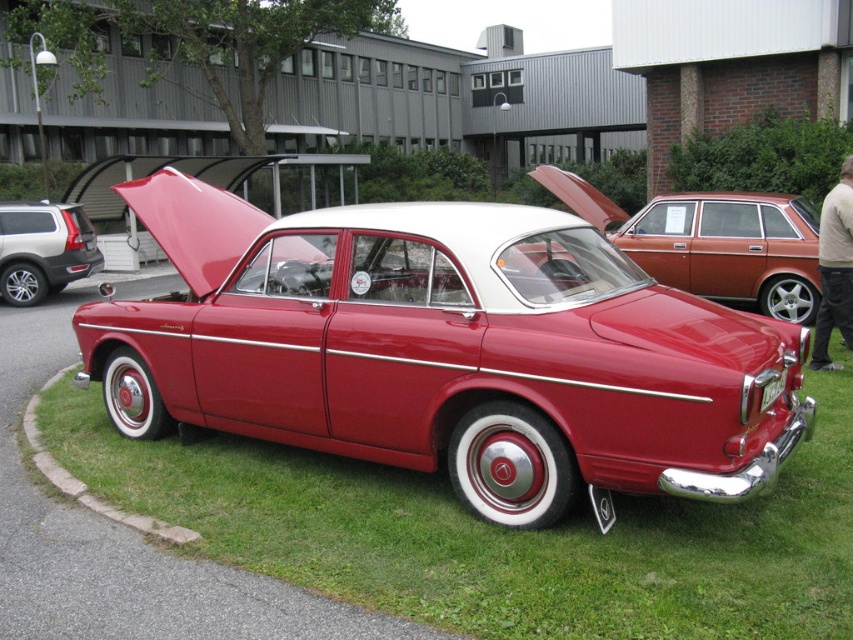
What do you see at coordinates (711, 241) in the screenshot? I see `shiny red car at center` at bounding box center [711, 241].

Is point (700, 285) farther from viewer compared to point (4, 221)?

No.

Which is in front, point (587, 204) or point (4, 250)?

Point (587, 204)

You are a GUI agent. You are given a task and a screenshot of the screen. Output one action in this format:
    pyautogui.click(x=<x>, y=<y>)
    Task: Click on the shiny red car at center
    
    Given the screenshot: What is the action you would take?
    pyautogui.click(x=711, y=241)

Does green grass at lower center appear on the right side of matte silver suv at left?

Yes, green grass at lower center is to the right of matte silver suv at left.

Who is more distant from viewer, (722, 563) or (68, 244)?

The point (68, 244) is behind.

Which is in front, point (793, 461) or point (51, 241)?

Point (793, 461) is more forward.

This screenshot has width=853, height=640. What are the coordinates of `green grass at lower center` in the screenshot? It's located at (496, 532).

Between point (329, 291) and point (111, 444), which one is positioned in front?

Positioned in front is point (329, 291).

What do you see at coordinates (445, 349) in the screenshot? The image size is (853, 640). I see `glossy red car at center` at bounding box center [445, 349].

The height and width of the screenshot is (640, 853). What are the coordinates of `glossy red car at center` in the screenshot? It's located at (445, 349).